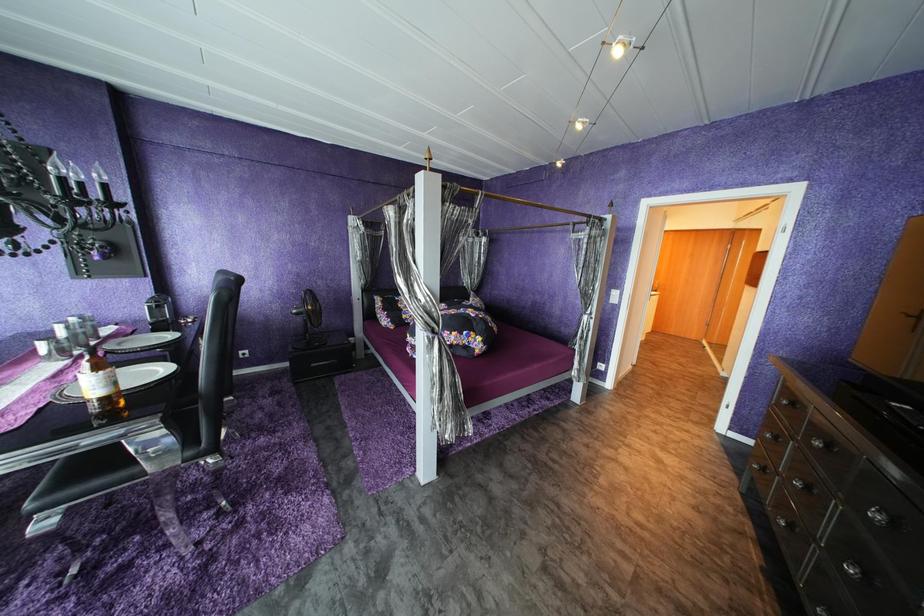
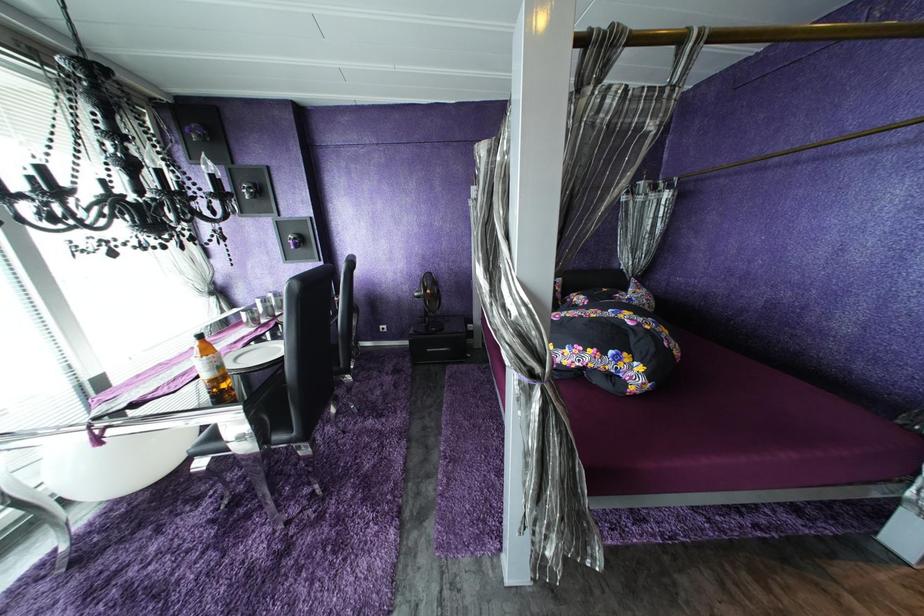
Question: The first image is from the beginning of the video and the second image is from the end. How did the camera likely rotate when shooting the video?

Choices:
 (A) Left
 (B) Right
 (C) Up
 (D) Down

Answer: (A)